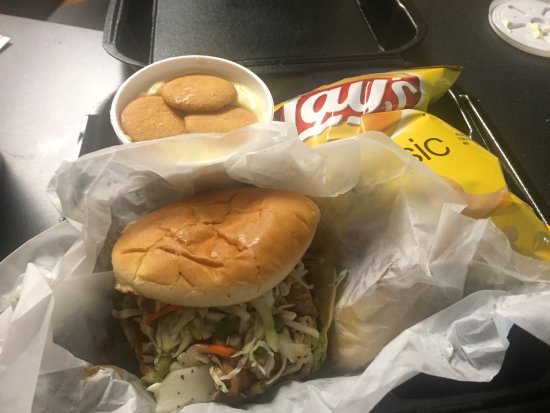
Identify the location of drink cover. This screenshot has width=550, height=413. (527, 20).